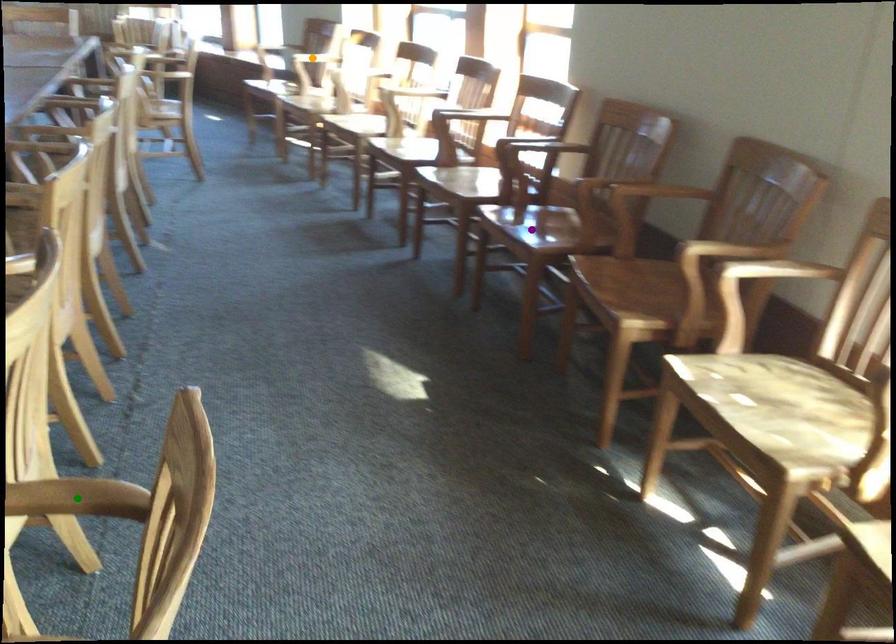
Order these from nearest to farthest:
A) green point
B) purple point
C) orange point

1. orange point
2. purple point
3. green point